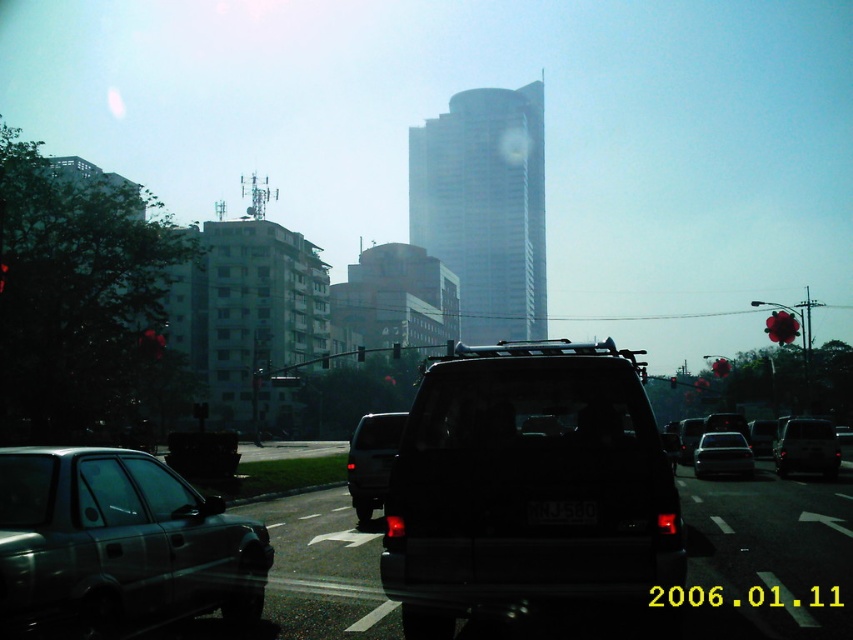
Question: Estimate the real-world distances between objects in this image. Which object is farther from the black plastic license plate at center?

Choices:
 (A) matte black suv at center
 (B) red glass traffic light at center
 (C) black plastic traffic light at center

Answer: (B)

Question: Which of the following is the closest to the observer?

Choices:
 (A) black plastic traffic light at center
 (B) metallic traffic light at center
 (C) satin black suv at center

Answer: (C)

Question: Which point appears closest to the camera in this image?

Choices:
 (A) (398, 352)
 (B) (672, 378)

Answer: (A)

Question: Can you confirm if matte black suv at center is positioned above metallic traffic light at center?

Choices:
 (A) no
 (B) yes

Answer: (A)

Question: Can you confirm if black matte suv at center is wider than satin black suv at center?

Choices:
 (A) no
 (B) yes

Answer: (B)

Question: Can you confirm if matte black suv at center is positioned below metallic red traffic light at center?

Choices:
 (A) yes
 (B) no

Answer: (A)